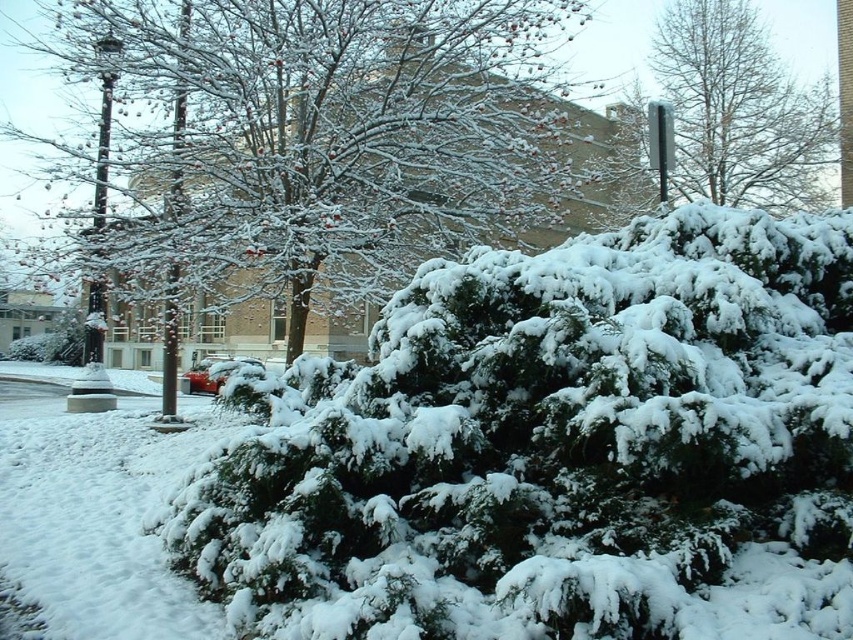
You are standing at the edge of the snowy area and want to take a photo of the green textured bush at upper center. If your camera has a maximum focus range of 30 feet, will it be able to capture the bush clearly?

The green textured bush at upper center is 29.63 feet away from the viewer. Since the camera can focus up to 30 feet, it will be able to capture the bush clearly within its range.